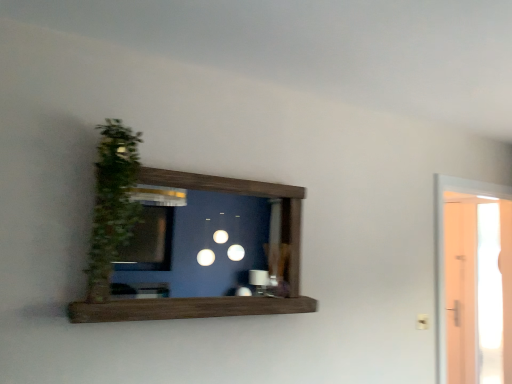
Question: Is transparent glass door at right facing away from green leafy plant at left?

Choices:
 (A) no
 (B) yes

Answer: (A)

Question: From a real-world perspective, does transparent glass door at right stand above green leafy plant at left?

Choices:
 (A) no
 (B) yes

Answer: (A)

Question: Considering the relative sizes of transparent glass door at right and green leafy plant at left in the image provided, is transparent glass door at right bigger than green leafy plant at left?

Choices:
 (A) yes
 (B) no

Answer: (A)

Question: Is the surface of transparent glass door at right in direct contact with green leafy plant at left?

Choices:
 (A) yes
 (B) no

Answer: (B)

Question: Considering the relative sizes of transparent glass door at right and green leafy plant at left in the image provided, is transparent glass door at right smaller than green leafy plant at left?

Choices:
 (A) yes
 (B) no

Answer: (B)

Question: From the image's perspective, is transparent glass door at right located above green leafy plant at left?

Choices:
 (A) yes
 (B) no

Answer: (B)

Question: Can you confirm if green leafy plant at left is taller than transparent glass door at right?

Choices:
 (A) yes
 (B) no

Answer: (B)

Question: Is green leafy plant at left facing away from transparent glass door at right?

Choices:
 (A) yes
 (B) no

Answer: (B)

Question: Would you say green leafy plant at left is a long distance from transparent glass door at right?

Choices:
 (A) no
 (B) yes

Answer: (B)

Question: Is the position of green leafy plant at left less distant than that of transparent glass door at right?

Choices:
 (A) yes
 (B) no

Answer: (A)

Question: Would you say transparent glass door at right is part of green leafy plant at left's contents?

Choices:
 (A) no
 (B) yes

Answer: (A)

Question: Would you say green leafy plant at left is outside transparent glass door at right?

Choices:
 (A) no
 (B) yes

Answer: (B)

Question: In the image, is transparent glass door at right positioned in front of or behind green leafy plant at left?

Choices:
 (A) behind
 (B) front

Answer: (A)